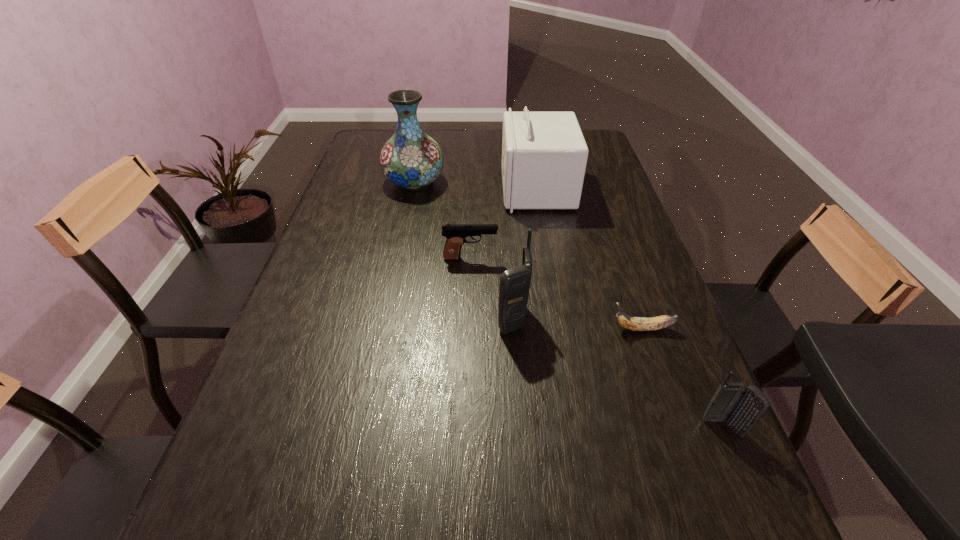
This screenshot has height=540, width=960. Find the location of `object located in the left edge section of the desktop`. object located in the left edge section of the desktop is located at coordinates (411, 159).

Find the location of a particular element. Image resolution: width=960 pixels, height=540 pixels. cellular telephone located in the right edge section of the desktop is located at coordinates (741, 407).

The image size is (960, 540). What are the coordinates of `the first-aid kit present at the right edge` in the screenshot? It's located at (544, 154).

The image size is (960, 540). I want to click on banana located in the right edge section of the desktop, so click(x=632, y=323).

What are the coordinates of `free spot at the far edge of the desktop` in the screenshot? It's located at (487, 149).

At what (x,y) coordinates should I click in order to perform the action: click on free space at the near edge. Please return your answer as a coordinate pair (x, y). Image resolution: width=960 pixels, height=540 pixels. Looking at the image, I should click on (386, 477).

You are a GUI agent. You are given a task and a screenshot of the screen. Output one action in this format:
    pyautogui.click(x=<x>, y=<y>)
    Task: Click on the vacant space at the left edge
    The height and width of the screenshot is (540, 960).
    Given the screenshot: What is the action you would take?
    pyautogui.click(x=286, y=337)

In the image, there is a desktop. In order to click on blank space at the right edge in this screenshot , I will do 628,234.

This screenshot has width=960, height=540. Find the location of `free space between the first-aid kit and the leftmost object`. free space between the first-aid kit and the leftmost object is located at coordinates (475, 186).

Locate an element on the screen. The image size is (960, 540). vacant space that's between the first-aid kit and the fourth nearest object is located at coordinates (504, 224).